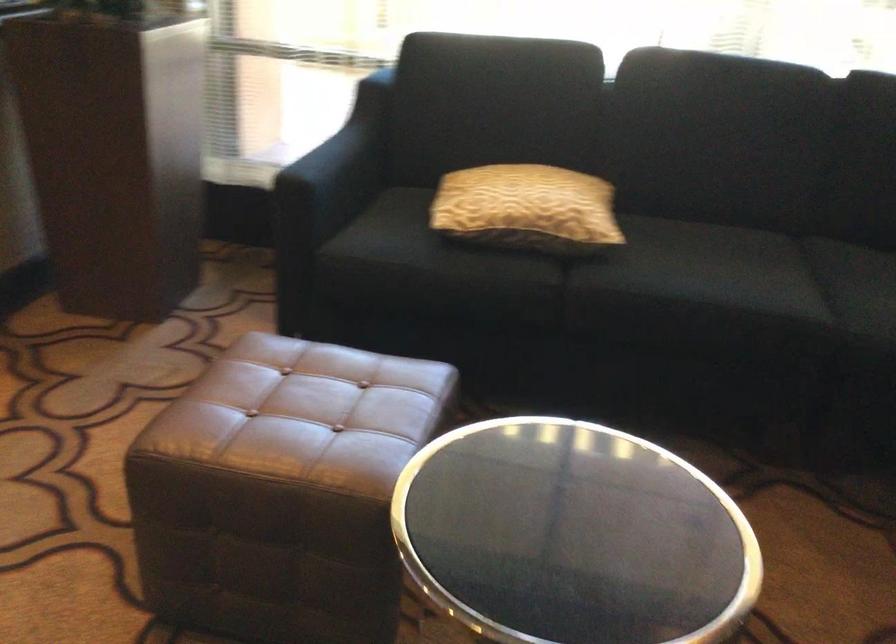
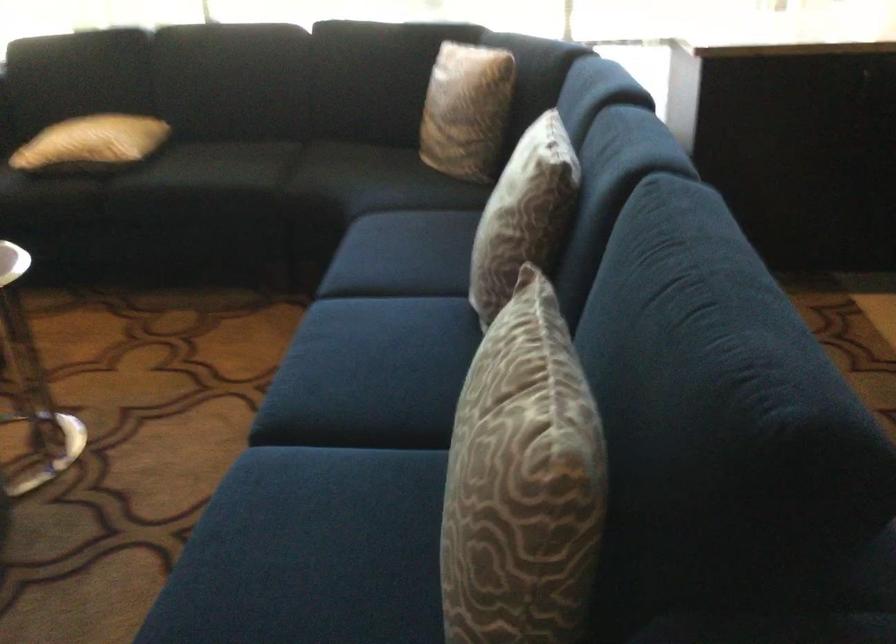
Where in the second image is the point corresponding to [510,93] from the first image?

(82, 64)